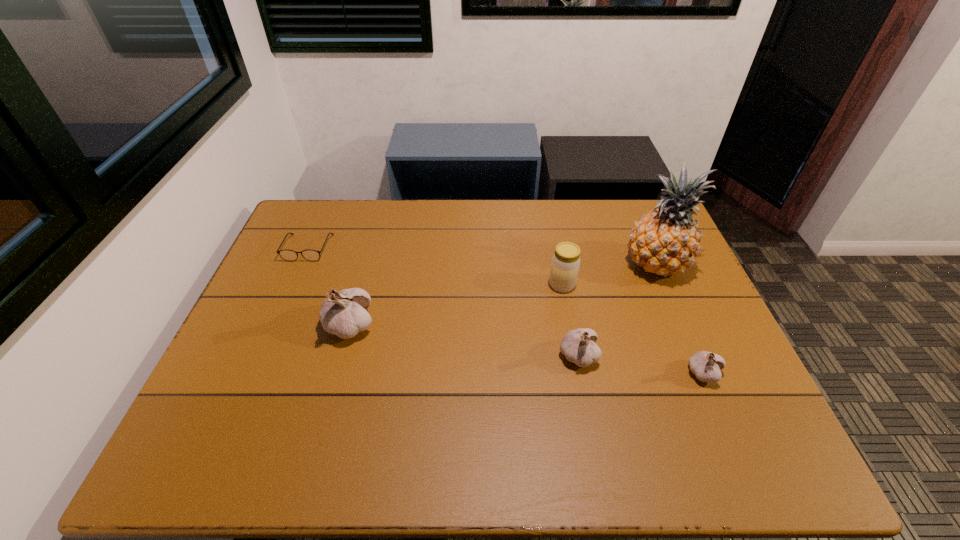
Locate an element on the screen. Image resolution: width=960 pixels, height=540 pixels. the tallest garlic is located at coordinates (343, 313).

Image resolution: width=960 pixels, height=540 pixels. In order to click on the fifth shortest object in this screenshot , I will do `click(343, 313)`.

At what (x,y) coordinates should I click in order to perform the action: click on the second tallest garlic. Please return your answer as a coordinate pair (x, y). Looking at the image, I should click on (579, 347).

Identify the location of the shortest garlic. (706, 366).

Find the location of a particular element. The height and width of the screenshot is (540, 960). the rightmost garlic is located at coordinates (706, 366).

At what (x,y) coordinates should I click in order to perform the action: click on pineapple. Please return your answer as a coordinate pair (x, y). The height and width of the screenshot is (540, 960). Looking at the image, I should click on (665, 241).

Where is `the shortest object`? the shortest object is located at coordinates (288, 255).

The height and width of the screenshot is (540, 960). What are the coordinates of `spectacles` in the screenshot? It's located at (288, 255).

At what (x,y) coordinates should I click in order to perform the action: click on jar. Please return your answer as a coordinate pair (x, y). The width and height of the screenshot is (960, 540). Looking at the image, I should click on (565, 264).

Find the location of `blank area located 0.200m on the front of the leftmost garlic`. blank area located 0.200m on the front of the leftmost garlic is located at coordinates (324, 417).